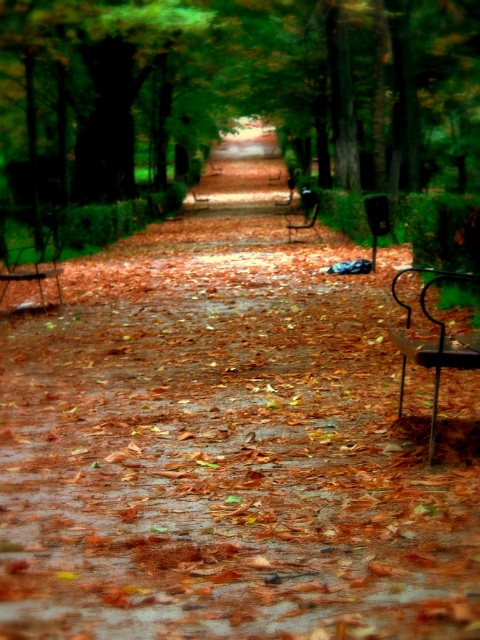
This screenshot has height=640, width=480. What do you see at coordinates (34, 269) in the screenshot?
I see `wooden bench at left` at bounding box center [34, 269].

Looking at this image, can you confirm if wooden bench at left is positioned to the left of metallic silver bench at center?

Yes, wooden bench at left is to the left of metallic silver bench at center.

Does point (44, 296) come farther from viewer compared to point (312, 216)?

No.

Find the location of `wooden bench at left`. wooden bench at left is located at coordinates (34, 269).

How distant is metallic black bench at right from wooden bench at left?

metallic black bench at right and wooden bench at left are 9.37 meters apart.

Is metallic black bench at right wider than wooden bench at left?

Incorrect, metallic black bench at right's width does not surpass wooden bench at left's.

Locate an element on the screen. Image resolution: width=480 pixels, height=640 pixels. metallic black bench at right is located at coordinates (432, 342).

You are a GUI agent. You are given a task and a screenshot of the screen. Output one action in this format:
    pyautogui.click(x=<x>, y=<y>)
    Task: Click on the metallic black bench at right
    This screenshot has height=640, width=480.
    Given the screenshot: What is the action you would take?
    pyautogui.click(x=432, y=342)

Between metallic black bench at right and metallic silver bench at center, which one is positioned higher?

metallic silver bench at center

Does metallic black bench at right appear under metallic silver bench at center?

Yes.

Between point (445, 337) and point (287, 225), which one is positioned behind?

Positioned behind is point (287, 225).

The width and height of the screenshot is (480, 640). In order to click on metallic black bench at right in this screenshot , I will do `click(432, 342)`.